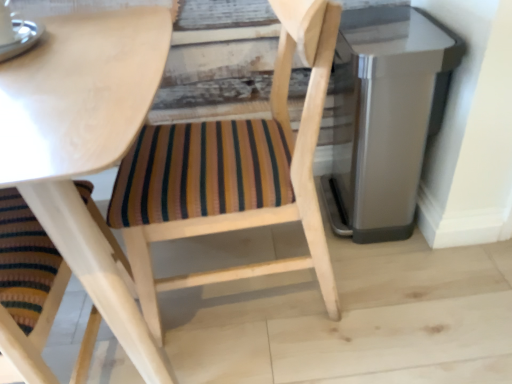
You are a GUI agent. You are given a task and a screenshot of the screen. Output one action in this format:
    pyautogui.click(x=<x>, y=<y>)
    Task: Click on the vacant space underneath wooden chair with striped cushion at center (from a real-world perspective)
    This screenshot has height=384, width=512.
    Given the screenshot: What is the action you would take?
    pyautogui.click(x=263, y=280)